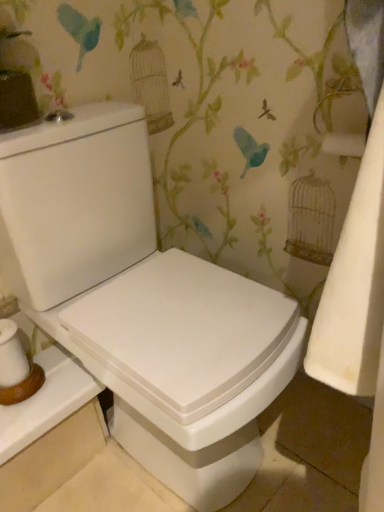
Locate an element on the screen. white glossy toilet at center is located at coordinates (142, 303).

This screenshot has height=512, width=384. What do you see at coordinates (142, 303) in the screenshot?
I see `white glossy toilet at center` at bounding box center [142, 303].

Image resolution: width=384 pixels, height=512 pixels. Identify the location of white glossy toilet at center. (142, 303).